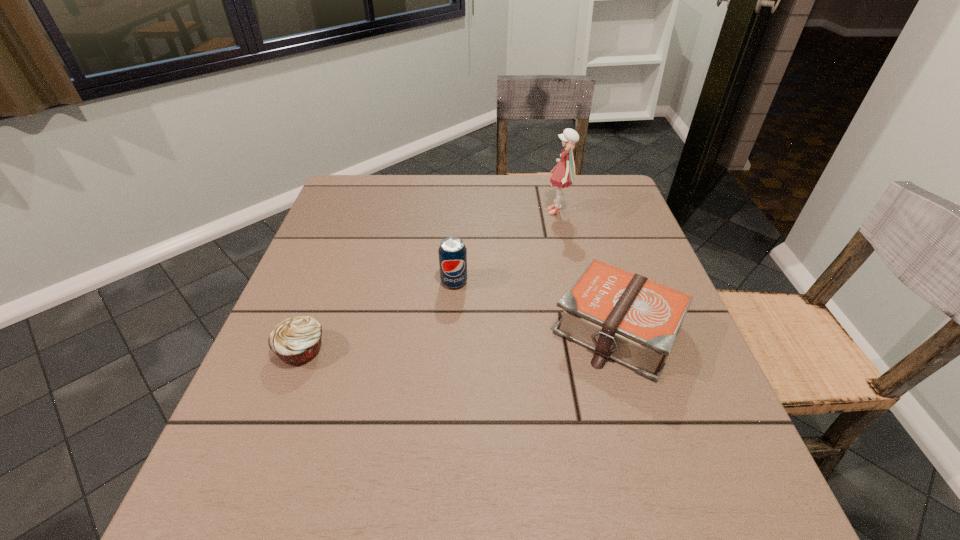
This screenshot has height=540, width=960. What are the coordinates of `vacant space that satisfies the following two spatial constraints: 1. on the front-facing side of the tallest object; 2. on the right side of the second shortest object` in the screenshot? It's located at (586, 329).